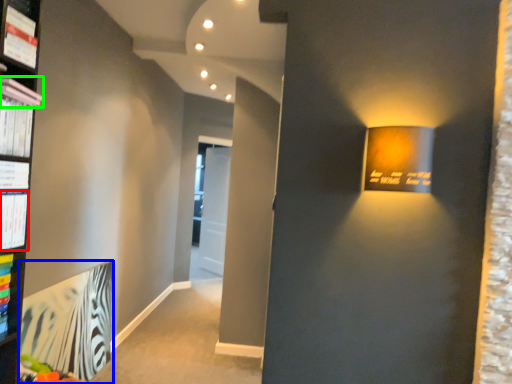
Question: Which object is positioned closest to paperback book (highlighted by a red box)? Select from paperback book (highlighted by a blue box) and book (highlighted by a green box).

Choices:
 (A) paperback book
 (B) book

Answer: (B)